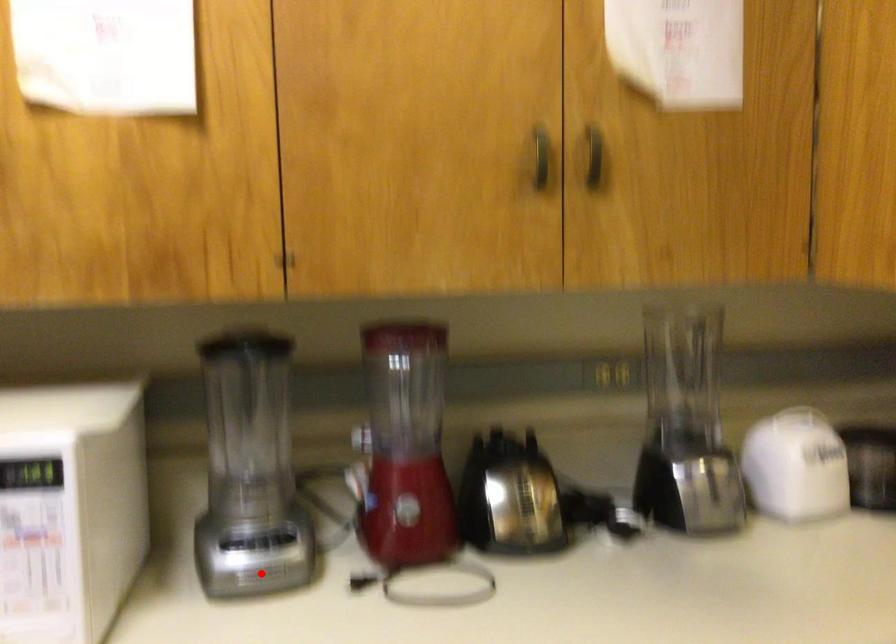
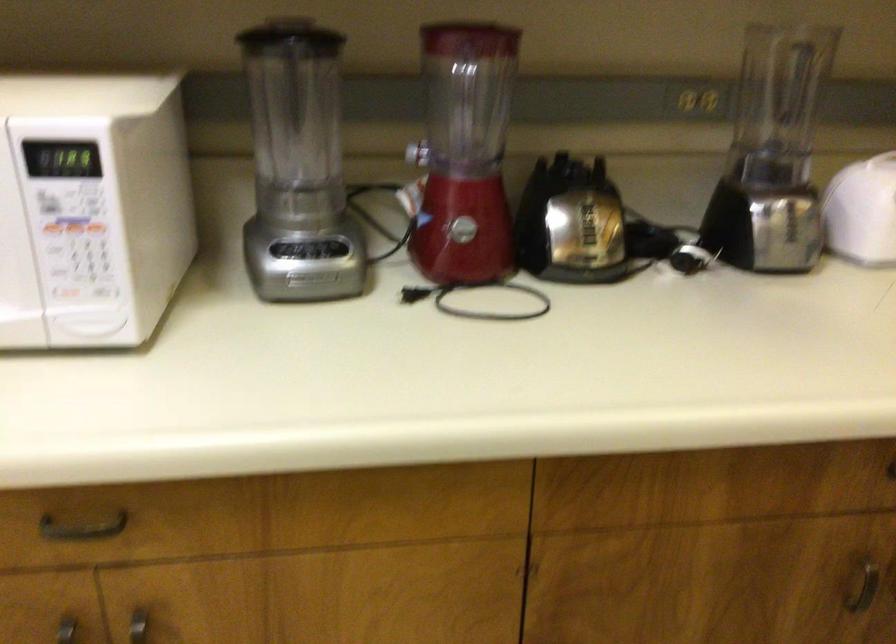
Locate, in the second image, the point that corresponds to the highlighted location in the first image.

(309, 278)